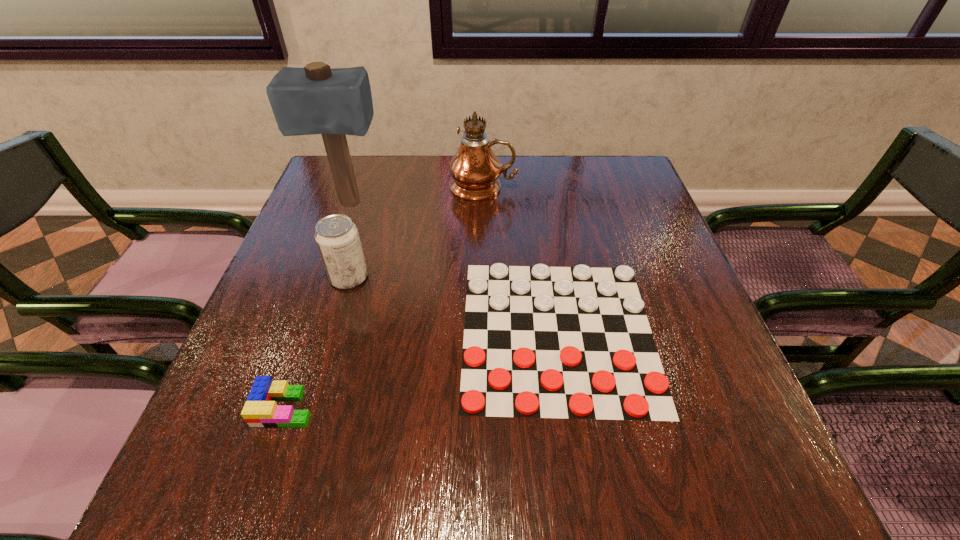
In the image, there is a desktop. What are the coordinates of `free space at the far left corner` in the screenshot? It's located at (332, 200).

Where is `empty space between the shortest object and the mallet`? This screenshot has height=540, width=960. empty space between the shortest object and the mallet is located at coordinates (453, 268).

You are a GUI agent. You are given a task and a screenshot of the screen. Output one action in this format:
    pyautogui.click(x=<x>, y=<y>)
    Task: Click on the free spot between the shortest object and the soda can
    
    Given the screenshot: What is the action you would take?
    pyautogui.click(x=453, y=305)

The width and height of the screenshot is (960, 540). I want to click on vacant area between the Lego and the oil lamp, so point(384,298).

At what (x,y) coordinates should I click in order to perform the action: click on vacant area that lies between the checkerboard and the fourth tallest object. Please return your answer as a coordinate pair (x, y). Looking at the image, I should click on (421, 369).

The height and width of the screenshot is (540, 960). In order to click on free point between the oil lamp and the mallet in this screenshot , I will do `click(417, 195)`.

I want to click on empty location between the oil lamp and the mallet, so click(417, 195).

Where is `free space between the checkerboard and the mallet`? The image size is (960, 540). free space between the checkerboard and the mallet is located at coordinates (453, 268).

Where is `vacant space in between the oil lamp and the shortest object`? vacant space in between the oil lamp and the shortest object is located at coordinates (520, 259).

Point out which object is positioned as the second nearest to the oil lamp. Please provide its 2D coordinates. Your answer should be formatted as a tuple, i.e. [(x, y)], where the tuple contains the x and y coordinates of a point satisfying the conditions above.

[(576, 343)]